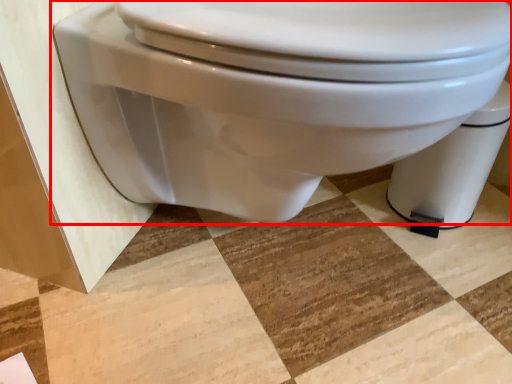
Question: In this image, where is toilet (annotated by the red box) located relative to toilet bowl?

Choices:
 (A) right
 (B) left

Answer: (B)